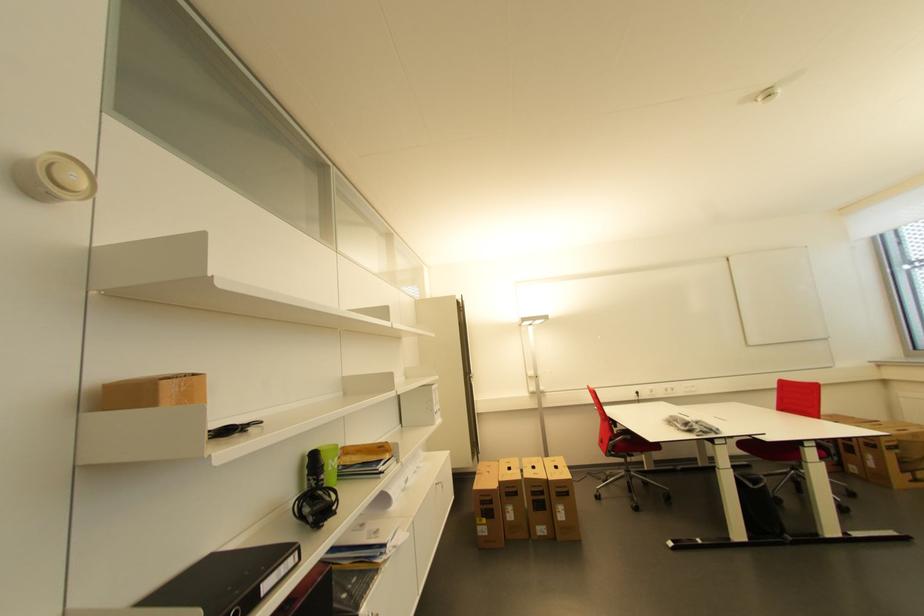
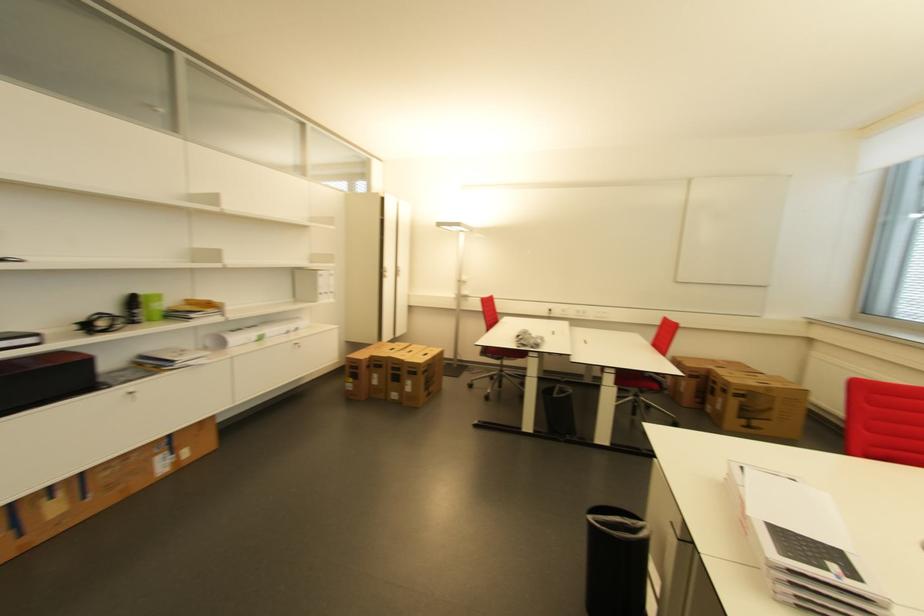
The point at (827, 459) is marked in the first image. Where is the corresponding point in the second image?

(622, 386)